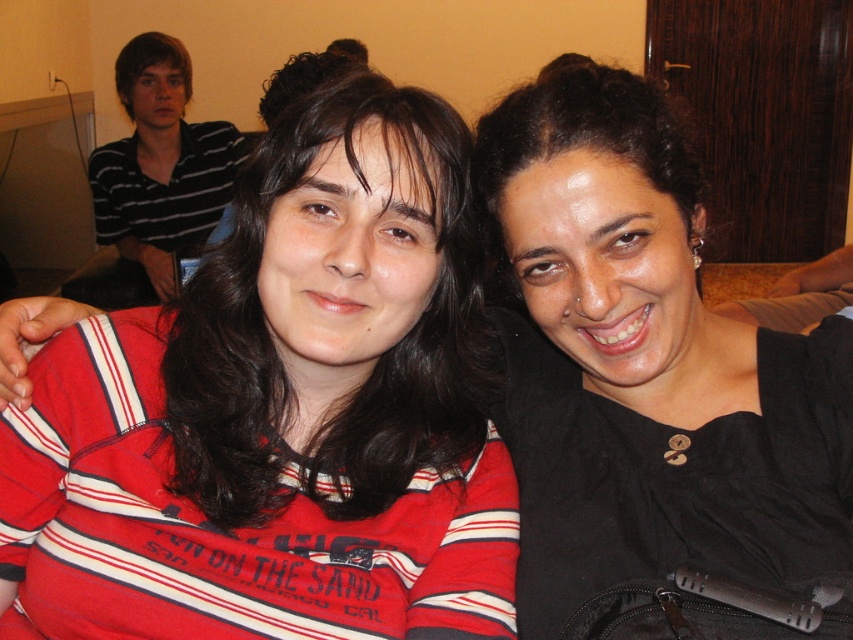
Based on the scene description, which object is shorter between the red striped shirt at left and the striped cotton shirt at upper left?

The red striped shirt at left is shorter than the striped cotton shirt at upper left.

You are standing in the room and want to hand a drink to the person wearing the red striped shirt at left. Based on their position, where should you approach them from?

The red striped shirt at left is located at point (x=280, y=413), so you should approach them from the right side since they are positioned on the left side of the scene.